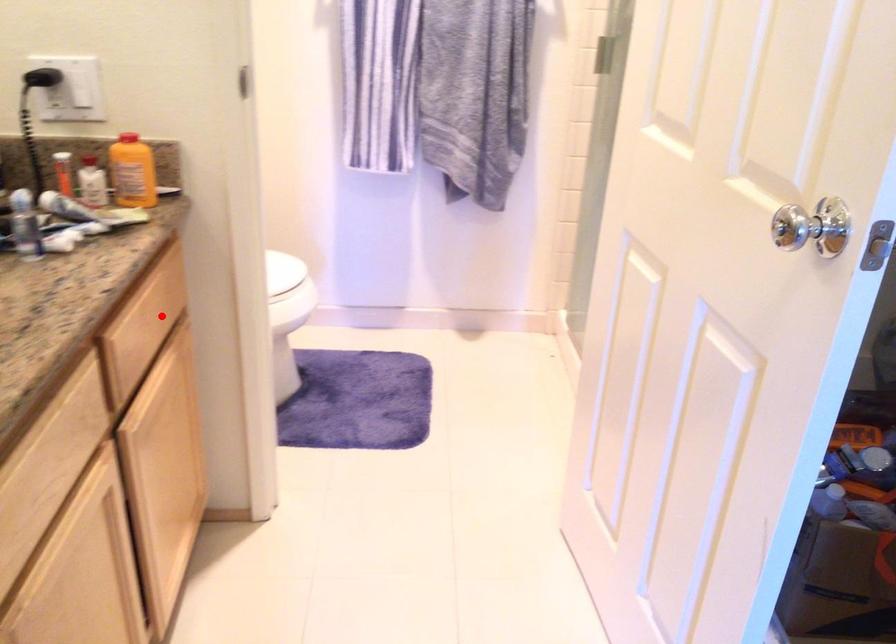
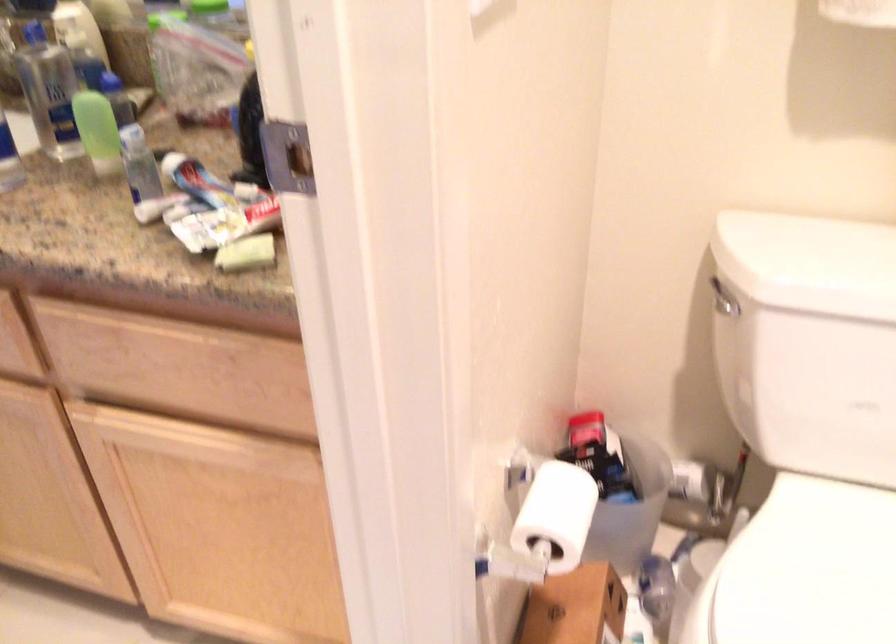
The point at the highlighted location is marked in the first image. Where is the corresponding point in the second image?

(177, 368)